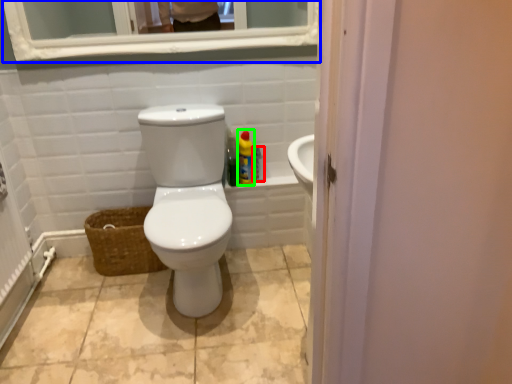
Question: Estimate the real-world distances between objects in this image. Which object is farther from cleaning product (highlighted by a red box), medicine cabinet (highlighted by a blue box) or cleaning product (highlighted by a green box)?

Choices:
 (A) medicine cabinet
 (B) cleaning product

Answer: (A)